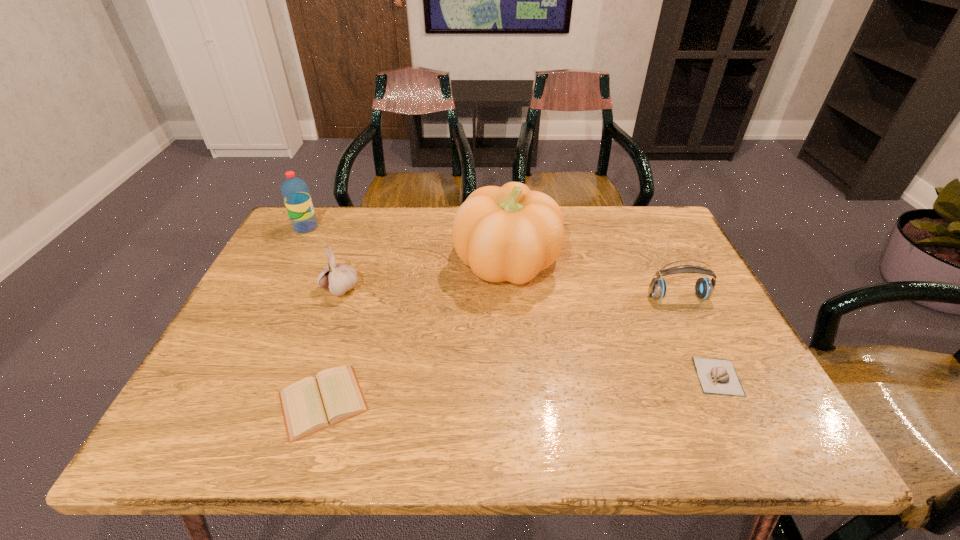
Identify the location of vacant space located 0.320m on the front of the fourth object from left to right. Image resolution: width=960 pixels, height=540 pixels. (518, 412).

The image size is (960, 540). In order to click on vacant space located on the front label of the leftmost object in this screenshot , I will do `click(348, 227)`.

What are the coordinates of `free space located on the right of the left garlic` in the screenshot? It's located at (501, 289).

Image resolution: width=960 pixels, height=540 pixels. What are the coordinates of `vacant space situated 0.190m on the ear cups of the headset` in the screenshot? It's located at (711, 367).

Where is `free point located 0.090m on the front of the right garlic`? The height and width of the screenshot is (540, 960). free point located 0.090m on the front of the right garlic is located at coordinates pyautogui.click(x=748, y=438).

Find the location of a particular element. Image resolution: width=960 pixels, height=540 pixels. vacant space located on the right of the diary is located at coordinates click(526, 402).

This screenshot has width=960, height=540. Identify the location of pumpkin at the far edge. (510, 233).

Find the location of a particular element. Image resolution: width=960 pixels, height=540 pixels. water bottle positioned at the far edge is located at coordinates (295, 192).

The image size is (960, 540). I want to click on object that is at the near edge, so click(311, 404).

Identify the location of object that is at the left edge. The image size is (960, 540). (295, 192).